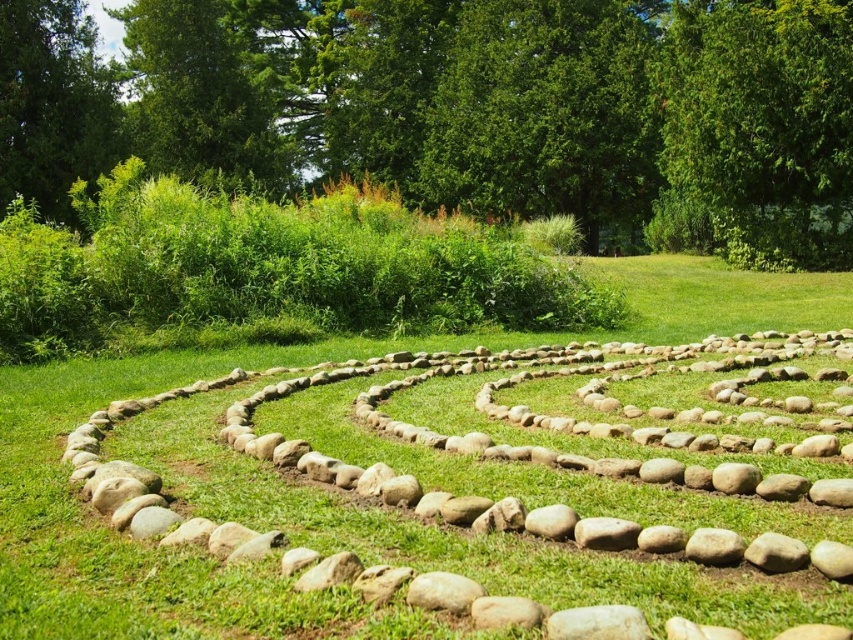
You are a gardener planning to place a new decorative statue in the center of the labyrinth. The statue requires a flat, stable base. Given the presence of both the natural stone at center and the smooth gray rock at center, which object would be the best foundation for the statue?

The smooth gray rock at center would be the best foundation for the statue because the natural stone at center is positioned over it, indicating the smooth gray rock is more stable and level.